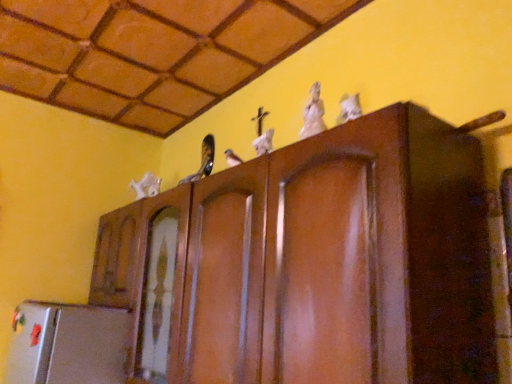
Question: Is white matte animal at left, which is counted as the first animal, starting from the back, positioned far away from white glossy statue at upper center, placed as the 2th animal when sorted from front to back?

Choices:
 (A) yes
 (B) no

Answer: (A)

Question: Is white matte animal at left, placed as the third animal when sorted from right to left, closer to the viewer compared to white glossy statue at upper center, placed as the 2th animal when sorted from front to back?

Choices:
 (A) yes
 (B) no

Answer: (B)

Question: Can you confirm if white matte animal at left, which is counted as the first animal, starting from the back, is thinner than white glossy statue at upper center, which ranks as the 2th animal in back-to-front order?

Choices:
 (A) no
 (B) yes

Answer: (A)

Question: Is white matte animal at left, which is the 1th animal in left-to-right order, positioned behind white glossy statue at upper center, which ranks as the 2th animal in back-to-front order?

Choices:
 (A) no
 (B) yes

Answer: (B)

Question: Is white matte animal at left, placed as the third animal when sorted from right to left, at the left side of white glossy statue at upper center, which ranks as the 2th animal in back-to-front order?

Choices:
 (A) yes
 (B) no

Answer: (A)

Question: Is white matte animal at left, the third animal in the front-to-back sequence, positioned with its back to white glossy statue at upper center, the second animal in the left-to-right sequence?

Choices:
 (A) no
 (B) yes

Answer: (A)

Question: Does white glossy statue at upper center, the second animal in the left-to-right sequence, have a lesser width compared to white matte animal at left, the third animal in the front-to-back sequence?

Choices:
 (A) no
 (B) yes

Answer: (B)

Question: Are white glossy statue at upper center, the second animal in the left-to-right sequence, and white matte animal at left, placed as the third animal when sorted from right to left, located far from each other?

Choices:
 (A) no
 (B) yes

Answer: (B)

Question: Is white glossy statue at upper center, which ranks as the 2th animal in back-to-front order, in contact with white matte animal at left, which is the 1th animal in left-to-right order?

Choices:
 (A) no
 (B) yes

Answer: (A)

Question: Is white glossy statue at upper center, the second animal in the left-to-right sequence, taller than white matte animal at left, which is the 1th animal in left-to-right order?

Choices:
 (A) yes
 (B) no

Answer: (A)

Question: From a real-world perspective, is white glossy statue at upper center, placed as the 2th animal when sorted from front to back, on top of white matte animal at left, placed as the third animal when sorted from right to left?

Choices:
 (A) no
 (B) yes

Answer: (A)

Question: Considering the relative positions of white glossy statue at upper center, which appears as the second animal when viewed from the right, and white matte animal at left, which is the 1th animal in left-to-right order, in the image provided, is white glossy statue at upper center, which appears as the second animal when viewed from the right, in front of white matte animal at left, which is the 1th animal in left-to-right order,?

Choices:
 (A) yes
 (B) no

Answer: (A)

Question: Is white glossy statue at upper center, which ranks as the 2th animal in back-to-front order, bigger than white glossy cat at upper right, the third animal viewed from the left?

Choices:
 (A) no
 (B) yes

Answer: (B)